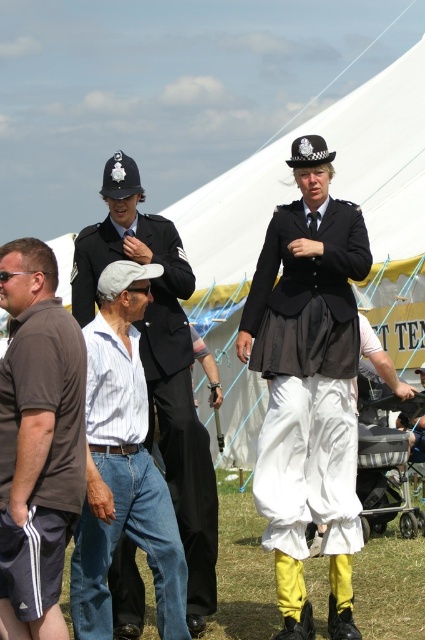
Question: Which object is the farthest from the black satin skirt at center?

Choices:
 (A) brown cotton shirt at lower left
 (B) black fabric uniform at center

Answer: (A)

Question: In this image, where is black satin skirt at center located relative to brown cotton shirt at lower left?

Choices:
 (A) above
 (B) below

Answer: (A)

Question: Can you confirm if brown cotton shirt at lower left is wider than black fabric uniform at center?

Choices:
 (A) yes
 (B) no

Answer: (B)

Question: Does black satin skirt at center have a larger size compared to black fabric uniform at center?

Choices:
 (A) no
 (B) yes

Answer: (A)

Question: Estimate the real-world distances between objects in this image. Which object is farther from the black fabric uniform at center?

Choices:
 (A) black satin skirt at center
 (B) brown cotton shirt at lower left

Answer: (B)

Question: Which object is farther from the camera taking this photo?

Choices:
 (A) black satin skirt at center
 (B) brown cotton shirt at lower left
 (C) black fabric uniform at center

Answer: (C)